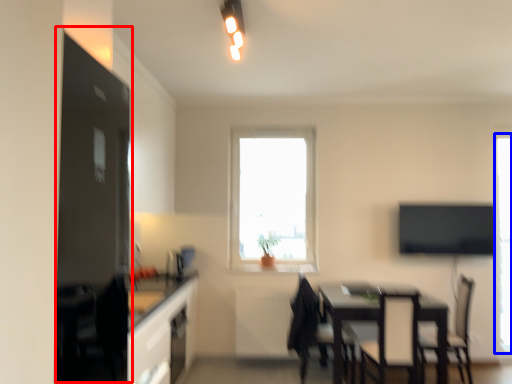
Question: Which of the following is the closest to the observer, fridge (highlighted by a red box) or window (highlighted by a blue box)?

Choices:
 (A) fridge
 (B) window

Answer: (A)